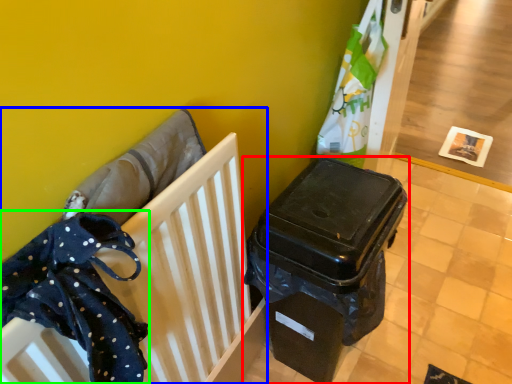
Question: Which object is the closest to the waste container (highlighted by a red box)? Choose among these: furniture (highlighted by a blue box) or clothe (highlighted by a green box).

Choices:
 (A) furniture
 (B) clothe

Answer: (A)